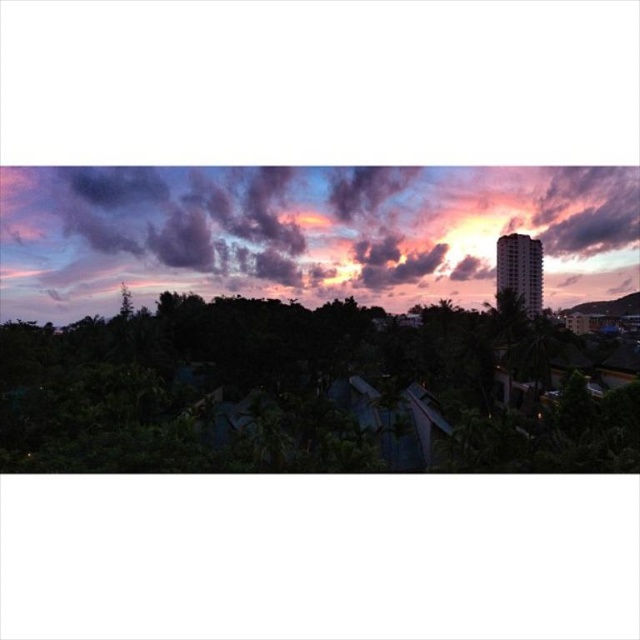
You are an artist sketching the sunset scene. You notice the green leafy tree at lower left and the purple matte cloud at upper center. Which object would you draw first if you want to follow the principle of starting with larger elements?

The purple matte cloud at upper center is larger than the green leafy tree at lower left, so you should draw the purple matte cloud at upper center first.

You are standing in the tropical landscape looking at the sunset. There are two points marked in the image. The first point is at coordinate point (500, 417) and the second is at coordinate point (58, 205). Which point is closer to you?

Point (500, 417) is closer to the camera than point (58, 205), so the first point is closer to you.